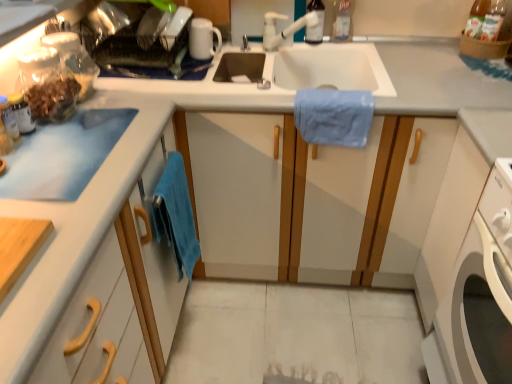
Question: Considering the relative sizes of white plastic faucet at upper center and transparent plastic bottle at upper center, the first bottle from the left, in the image provided, is white plastic faucet at upper center taller than transparent plastic bottle at upper center, the first bottle from the left,?

Choices:
 (A) no
 (B) yes

Answer: (A)

Question: From the image's perspective, is white plastic faucet at upper center under transparent plastic bottle at upper center, the first bottle from the left?

Choices:
 (A) no
 (B) yes

Answer: (B)

Question: Is white plastic faucet at upper center next to transparent plastic bottle at upper center, which is counted as the 2th bottle, starting from the right, and touching it?

Choices:
 (A) yes
 (B) no

Answer: (A)

Question: Is white plastic faucet at upper center not near transparent plastic bottle at upper center, which is counted as the 2th bottle, starting from the right?

Choices:
 (A) no
 (B) yes

Answer: (A)

Question: Is white plastic faucet at upper center bigger than transparent plastic bottle at upper center, which is counted as the 2th bottle, starting from the right?

Choices:
 (A) no
 (B) yes

Answer: (B)

Question: Could transparent plastic bottle at upper center, the first bottle from the left, be considered to be inside white plastic faucet at upper center?

Choices:
 (A) no
 (B) yes

Answer: (A)

Question: Is white plastic washing machine at lower right further to camera compared to white glossy mug at upper center?

Choices:
 (A) no
 (B) yes

Answer: (A)

Question: Is white plastic washing machine at lower right not close to white glossy mug at upper center?

Choices:
 (A) no
 (B) yes

Answer: (B)

Question: Is white plastic washing machine at lower right positioned beyond the bounds of white glossy mug at upper center?

Choices:
 (A) yes
 (B) no

Answer: (A)

Question: Is the surface of white plastic washing machine at lower right in direct contact with white glossy mug at upper center?

Choices:
 (A) yes
 (B) no

Answer: (B)

Question: From the image's perspective, is white plastic washing machine at lower right under white glossy mug at upper center?

Choices:
 (A) yes
 (B) no

Answer: (A)

Question: Is white glossy mug at upper center a part of white plastic washing machine at lower right?

Choices:
 (A) yes
 (B) no

Answer: (B)

Question: Are transparent plastic bottle at upper center, which is counted as the 2th bottle, starting from the right, and white plastic faucet at upper center located far from each other?

Choices:
 (A) yes
 (B) no

Answer: (B)